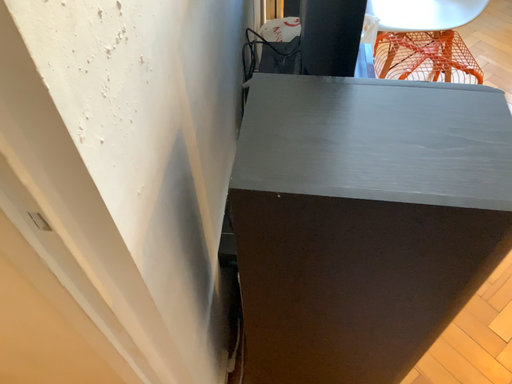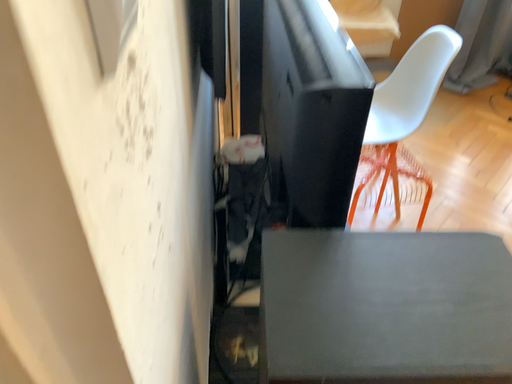
Question: Which way did the camera rotate in the video?

Choices:
 (A) rotated right
 (B) rotated left

Answer: (A)